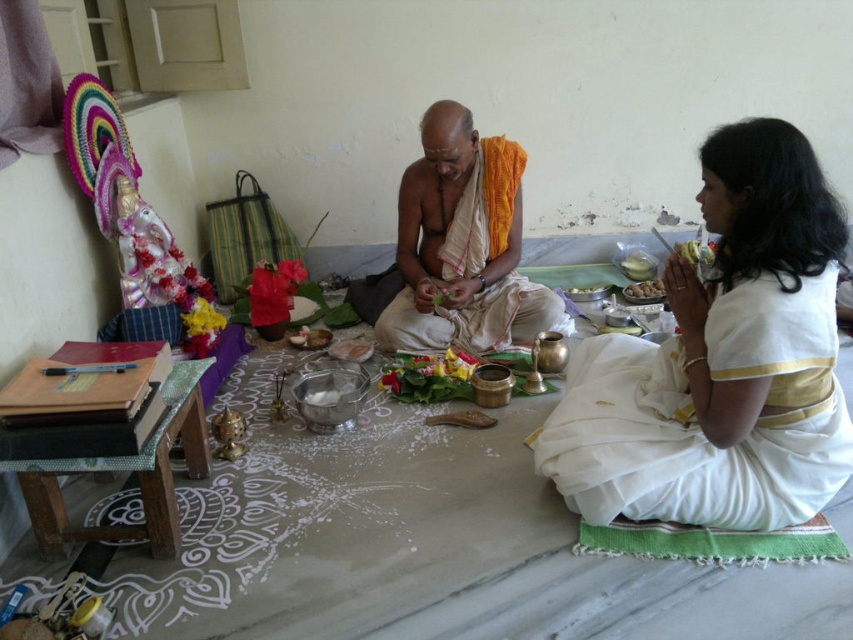
Does matte orange cloth at center lie in front of matte brown bowl at center?

Yes, it is.

Consider the image. Does matte orange cloth at center have a lesser width compared to matte brown bowl at center?

No.

This screenshot has height=640, width=853. I want to click on matte orange cloth at center, so [x=462, y=244].

Does matte brown bowl at center come behind yellow matte banana at right?

Yes, it is behind yellow matte banana at right.

Is point (329, 332) behind point (700, 257)?

No, it is in front of (700, 257).

Which is behind, point (311, 339) or point (689, 243)?

Positioned behind is point (689, 243).

Locate an element on the screen. matte brown bowl at center is located at coordinates (310, 337).

Identify the location of white silk saree at lower right. (721, 362).

Does white silk saree at lower right have a greater width compared to brown matte food at center?

Yes, white silk saree at lower right is wider than brown matte food at center.

At what (x,y) coordinates should I click in order to perform the action: click on white silk saree at lower right. Please return your answer as a coordinate pair (x, y). Looking at the image, I should click on (721, 362).

The width and height of the screenshot is (853, 640). Identify the location of white silk saree at lower right. (721, 362).